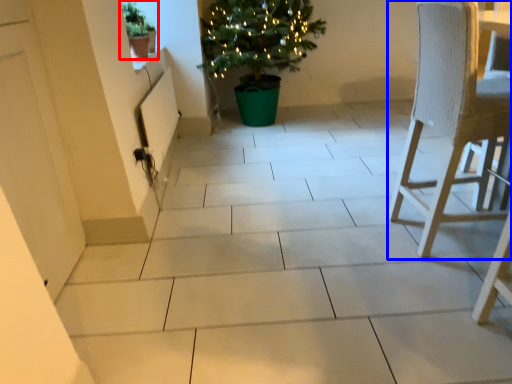
Question: Which point is closer to the camera, houseplant (highlighted by a red box) or chair (highlighted by a blue box)?

Choices:
 (A) houseplant
 (B) chair

Answer: (B)